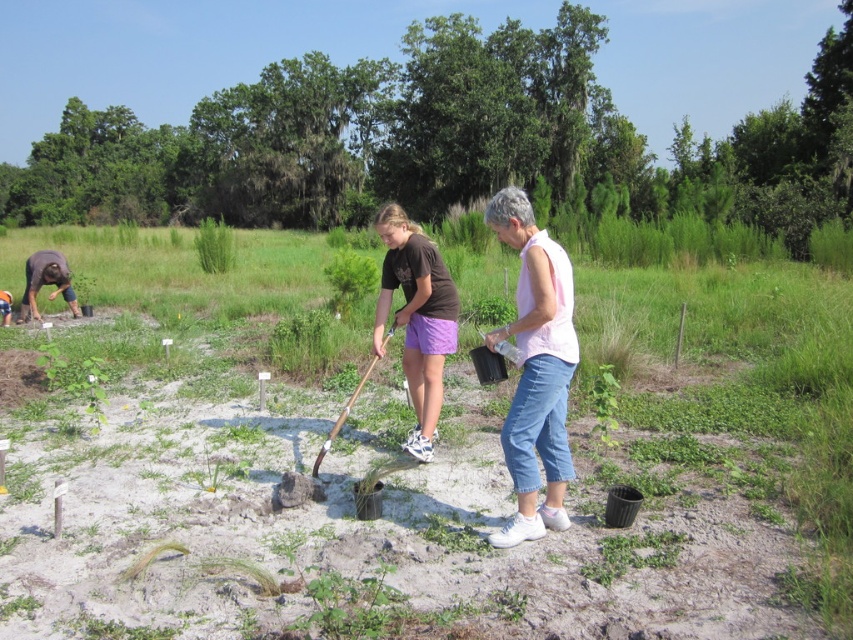
Question: Which of these objects is positioned closest to the green matte plant at lower center?

Choices:
 (A) wooden shovel at center
 (B) matte brown shirt at center
 (C) brown leather boots at lower left
 (D) brown fabric at left

Answer: (B)

Question: Is pink cotton shirt at center positioned in front of matte brown shirt at center?

Choices:
 (A) yes
 (B) no

Answer: (A)

Question: Which of these objects is positioned closest to the brown fabric at left?

Choices:
 (A) pink cotton shirt at center
 (B) wooden shovel at center
 (C) green grass at center

Answer: (B)

Question: Among these points, which one is farthest from the camera?

Choices:
 (A) (74, 298)
 (B) (345, 412)

Answer: (A)

Question: Is pink cotton shirt at center positioned behind green grass at center?

Choices:
 (A) no
 (B) yes

Answer: (A)

Question: Can you confirm if green matte plant at lower center is positioned to the left of brown fabric at left?

Choices:
 (A) no
 (B) yes

Answer: (A)